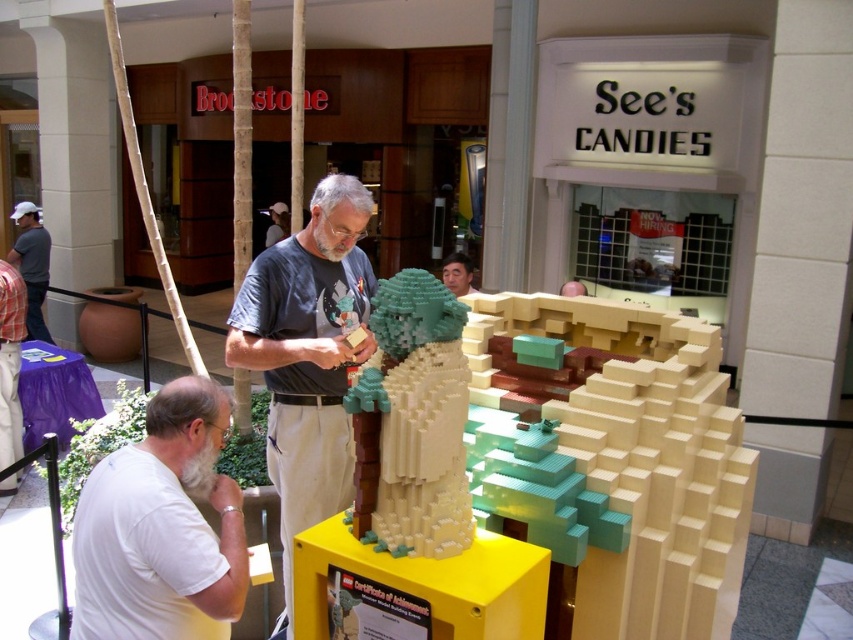
Is the position of white matte shirt at lower left more distant than that of white cotton shirt at left?

No.

Does point (196, 609) lie behind point (16, 214)?

No, it is in front of (16, 214).

Between point (231, 540) and point (19, 209), which one is positioned behind?

Point (19, 209)

Find the location of a particular element. This screenshot has height=640, width=853. white matte shirt at lower left is located at coordinates (161, 528).

Does point (363, 502) lie in front of point (577, 291)?

That is True.

Looking at this image, who is more forward, (463, 428) or (579, 284)?

Point (463, 428) is in front.

Who is more distant from viewer, (440, 353) or (582, 284)?

A: Point (582, 284)

You are a GUI agent. You are given a task and a screenshot of the screen. Output one action in this format:
    pyautogui.click(x=<x>, y=<y>)
    Task: Click on the green matte lego tree at center
    
    Given the screenshot: What is the action you would take?
    pyautogui.click(x=413, y=420)

Describe the element at coordinates (32, 266) in the screenshot. I see `white cotton shirt at left` at that location.

Which is below, white cotton shirt at left or matte gray shirt at center?

matte gray shirt at center is lower down.

This screenshot has width=853, height=640. What do you see at coordinates (32, 266) in the screenshot? I see `white cotton shirt at left` at bounding box center [32, 266].

Find the location of a particular element. white cotton shirt at left is located at coordinates (32, 266).